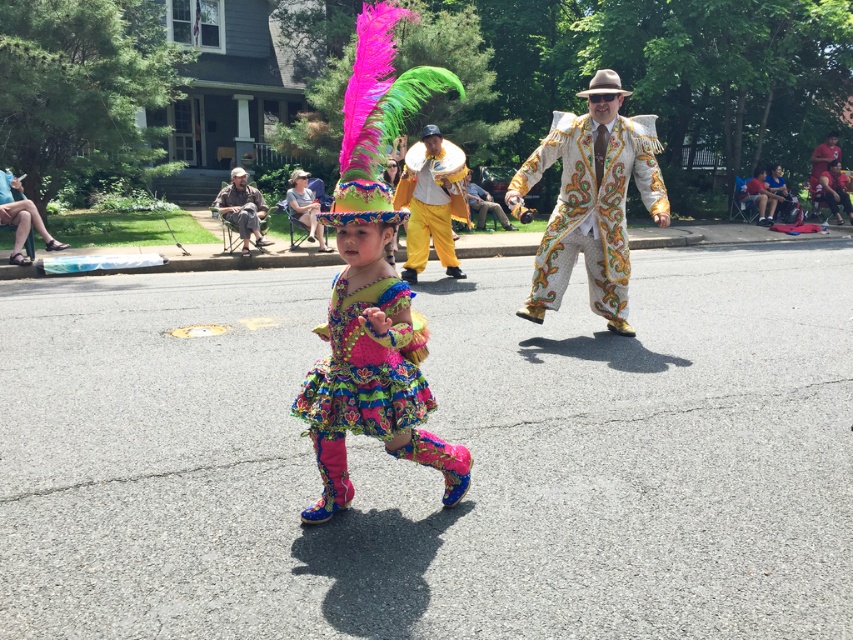
You are a photographer at the parade and want to capture both the white textured suit at center and the yellow satin pants at center in a single frame. Given their sizes, which object should you focus on to ensure both are visible without cropping?

The white textured suit at center is larger in size than the yellow satin pants at center, so focusing on the white textured suit at center would ensure both are visible as it takes up more space in the frame.

You are a photographer trying to capture the vibrant costumes in the scene. You have a camera that can only focus on one object at a time. Which object should you choose to ensure the costume details are clearly visible, the multicolored sequined dress at center or the yellow satin suit at center?

The multicolored sequined dress at center has a larger size compared to the yellow satin suit at center, so it will be easier to capture the details clearly.